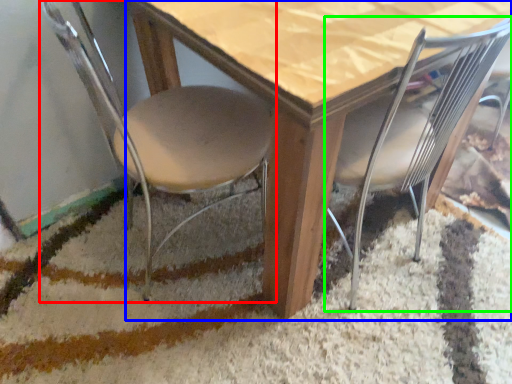
Question: Estimate the real-world distances between objects in this image. Which object is farther from chair (highlighted by a red box), table (highlighted by a blue box) or chair (highlighted by a green box)?

Choices:
 (A) table
 (B) chair

Answer: (B)